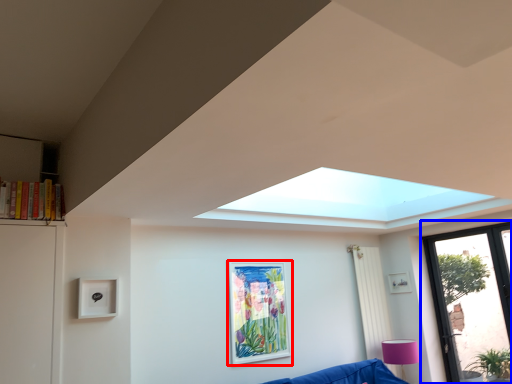
Question: Which object is further to the camera taking this photo, picture frame (highlighted by a red box) or window (highlighted by a blue box)?

Choices:
 (A) picture frame
 (B) window

Answer: (B)